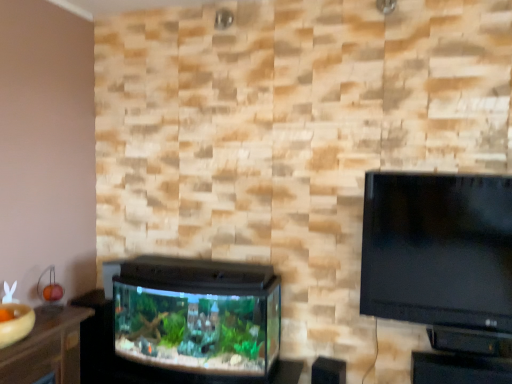
Question: Looking at their shapes, would you say wooden table at lower left is wider or thinner than black plastic table at lower right?

Choices:
 (A) thin
 (B) wide

Answer: (B)

Question: Based on their sizes in the image, would you say wooden table at lower left is bigger or smaller than black plastic table at lower right?

Choices:
 (A) small
 (B) big

Answer: (A)

Question: Considering the real-world distances, which object is farthest from the black plastic table at lower right?

Choices:
 (A) wooden table at lower left
 (B) black plastic aquarium at lower left

Answer: (A)

Question: Based on their relative distances, which object is nearer to the wooden table at lower left?

Choices:
 (A) black plastic aquarium at lower left
 (B) black plastic table at lower right

Answer: (A)